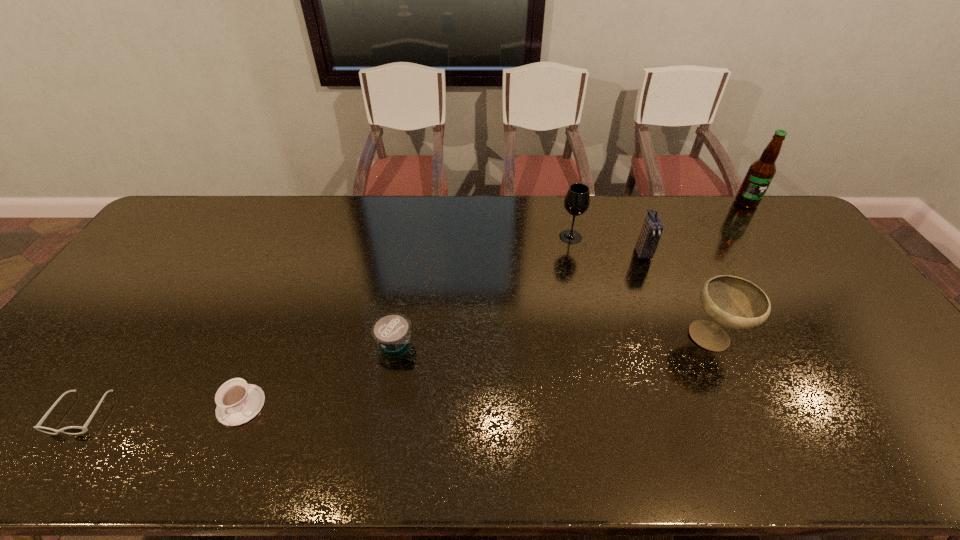
Where is `the tallest object`? the tallest object is located at coordinates point(761,172).

Where is `the farthest object`? This screenshot has height=540, width=960. the farthest object is located at coordinates (761, 172).

The width and height of the screenshot is (960, 540). Find the location of `the fourth object from left to right`. the fourth object from left to right is located at coordinates (577, 200).

Where is `chalice`? The image size is (960, 540). chalice is located at coordinates (731, 302).

Locate an element on the screen. The height and width of the screenshot is (540, 960). clutch bag is located at coordinates (651, 231).

Identify the location of yogurt. This screenshot has width=960, height=540. (392, 331).

At what (x,y) coordinates should I click in order to perform the action: click on teacup. Please return your answer as a coordinate pair (x, y). This screenshot has width=960, height=540. Looking at the image, I should click on (237, 402).

I want to click on the leftmost object, so click(x=74, y=430).

I want to click on the shortest object, so [74, 430].

Locate an element on the screen. This screenshot has height=540, width=960. free space located 0.250m on the label of the farthest object is located at coordinates (784, 256).